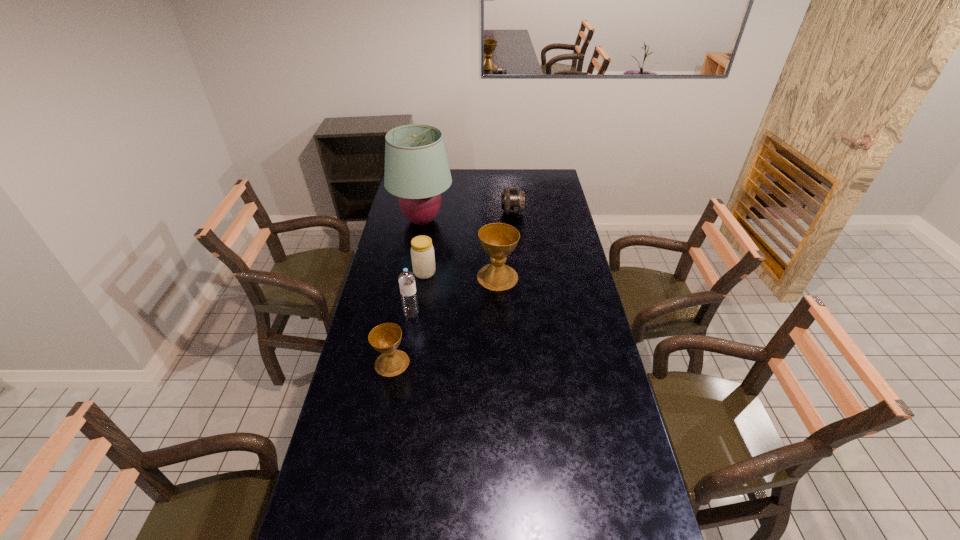
Where is `vacant point located on the front-facing side of the telephoto lens`? The width and height of the screenshot is (960, 540). vacant point located on the front-facing side of the telephoto lens is located at coordinates (x=457, y=212).

Where is `free region located 0.080m on the front-facing side of the telephoto lens`? The width and height of the screenshot is (960, 540). free region located 0.080m on the front-facing side of the telephoto lens is located at coordinates point(486,212).

I want to click on vacant space located 0.270m on the front-facing side of the telephoto lens, so click(x=449, y=212).

At what (x,y) coordinates should I click in order to perform the action: click on vacant area located 0.300m on the back of the lampshade. Please return your answer as a coordinate pair (x, y). Looking at the image, I should click on (430, 176).

Locate an element on the screen. Image resolution: width=960 pixels, height=540 pixels. free point located 0.160m on the back of the water bottle is located at coordinates (417, 281).

This screenshot has height=540, width=960. In order to click on vacant region located on the right of the jar in this screenshot , I will do `click(516, 273)`.

Locate an element on the screen. chalice that is positioned at the left edge is located at coordinates (385, 338).

Identify the location of lampshade that is positioned at the left edge. This screenshot has width=960, height=540. (417, 171).

Find the location of a particular element. water bottle present at the left edge is located at coordinates (406, 279).

Find the location of `jar positioned at the left edge`. jar positioned at the left edge is located at coordinates (422, 252).